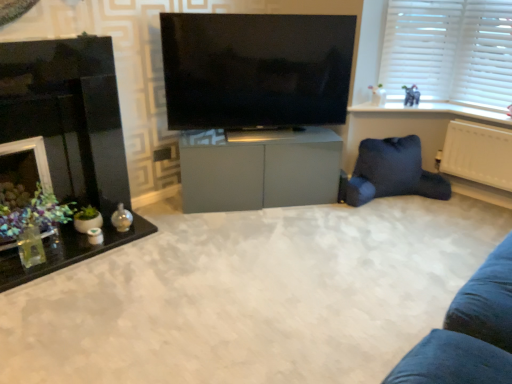
This screenshot has height=384, width=512. What are the coordinates of `empty space that is in between translucent glass table at left and dark blue fabric bean bag at lower right` in the screenshot? It's located at (226, 234).